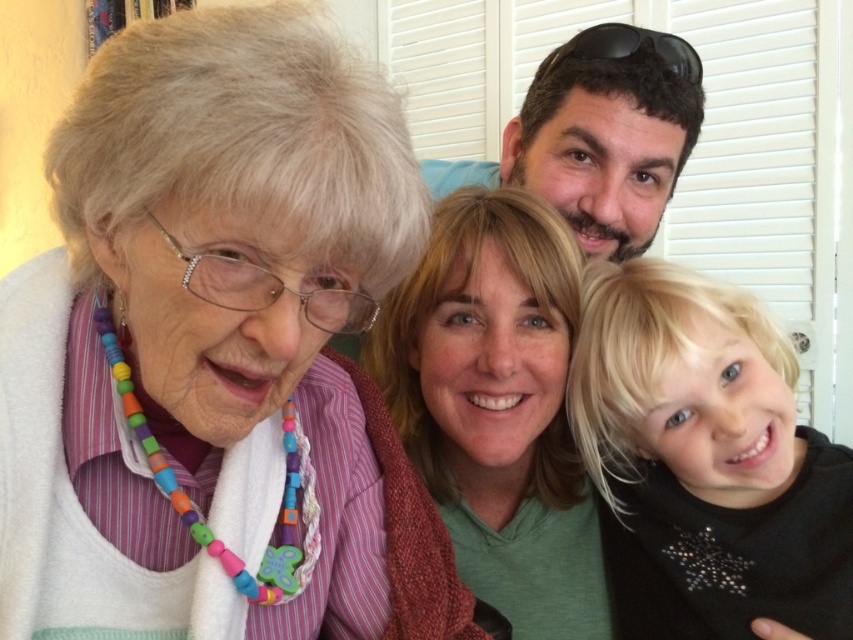
You are standing in front of the family photo and want to touch the two points mentioned. Which point, point (787, 400) or point (445, 372), would require you to reach further forward?

Point (445, 372) would require reaching further forward because it is farther from the camera compared to point (787, 400).